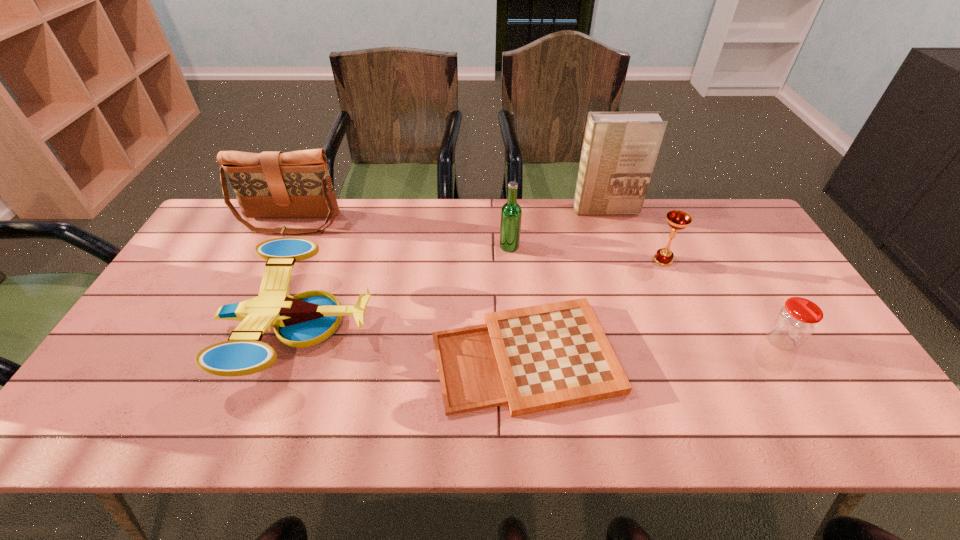
Where is `free space located on the left of the fourth shortest object`? free space located on the left of the fourth shortest object is located at coordinates (583, 260).

The height and width of the screenshot is (540, 960). What are the coordinates of `free space located at the cockpit of the drone` in the screenshot? It's located at (429, 327).

Image resolution: width=960 pixels, height=540 pixels. Identify the location of vacant space located 0.210m on the front of the jar. (836, 435).

The width and height of the screenshot is (960, 540). Find the location of `free point located 0.120m on the right of the gameboard`. free point located 0.120m on the right of the gameboard is located at coordinates (667, 355).

Locate an element on the screen. The width and height of the screenshot is (960, 540). phonebook that is at the far edge is located at coordinates (619, 151).

Locate an element on the screen. This screenshot has height=540, width=960. shoulder bag that is at the far edge is located at coordinates (272, 184).

Locate an element on the screen. This screenshot has width=960, height=540. beer bottle present at the far edge is located at coordinates (511, 213).

Where is `drone that is at the near edge`? drone that is at the near edge is located at coordinates (309, 318).

Identify the location of gameboard that is at the near edge. The width and height of the screenshot is (960, 540). (543, 357).

Where is `object positioned at the left edge`? The image size is (960, 540). object positioned at the left edge is located at coordinates (272, 184).